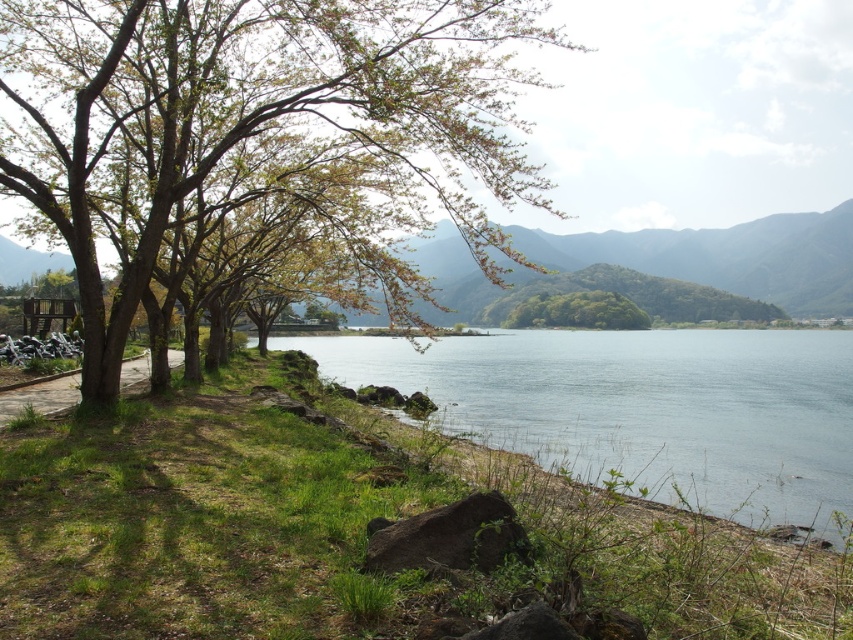
Who is more distant from viewer, (798, 474) or (560, 300)?

Positioned behind is point (560, 300).

Is clear water at lower center to the left of green leafy hill at center from the viewer's perspective?

Correct, you'll find clear water at lower center to the left of green leafy hill at center.

The image size is (853, 640). Describe the element at coordinates (642, 406) in the screenshot. I see `clear water at lower center` at that location.

You are a GUI agent. You are given a task and a screenshot of the screen. Output one action in this format:
    pyautogui.click(x=<x>, y=<y>)
    Task: Click on the clear water at lower center
    
    Given the screenshot: What is the action you would take?
    point(642,406)

Does smooth bark tree at left have a greater width compared to clear water at lower center?

Incorrect, smooth bark tree at left's width does not surpass clear water at lower center's.

Identify the location of smooth bark tree at left. (247, 116).

Is point (49, 163) in front of point (529, 326)?

Yes, it is in front of point (529, 326).

Consider the image. Who is more distant from viewer, (380, 182) or (535, 323)?

Positioned behind is point (535, 323).

Find the location of a particular element. This screenshot has width=853, height=640. smooth bark tree at left is located at coordinates (247, 116).